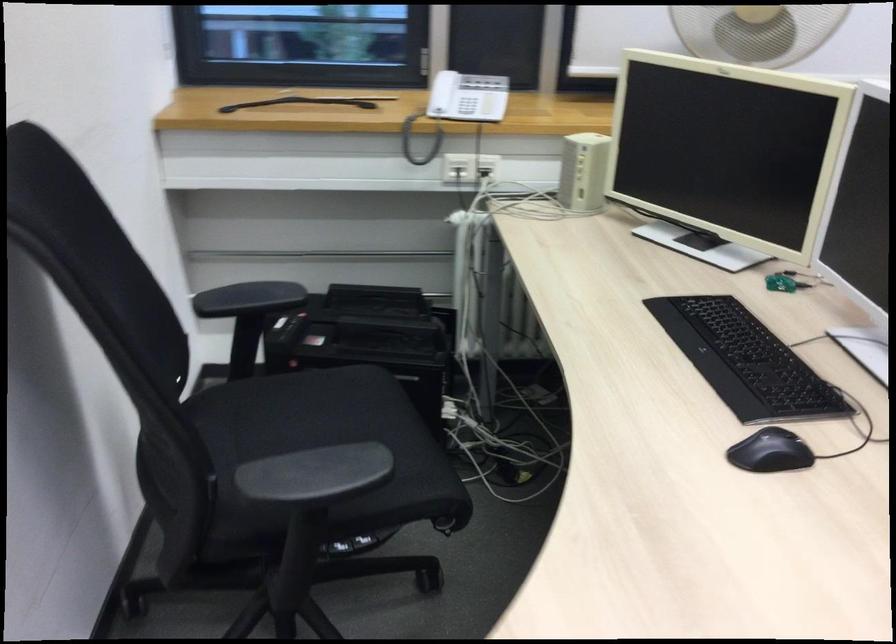
The height and width of the screenshot is (644, 896). What do you see at coordinates (355, 319) in the screenshot?
I see `a black printer lid` at bounding box center [355, 319].